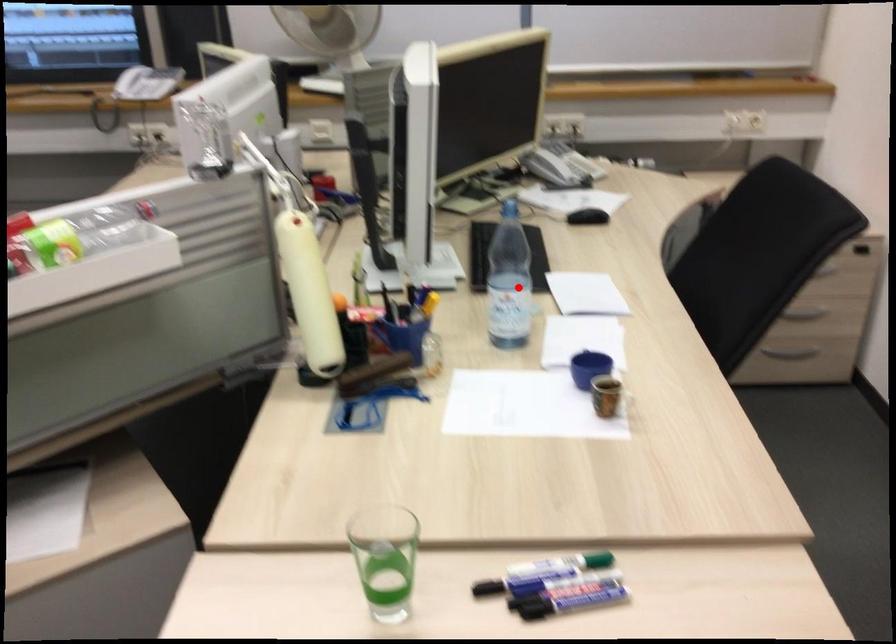
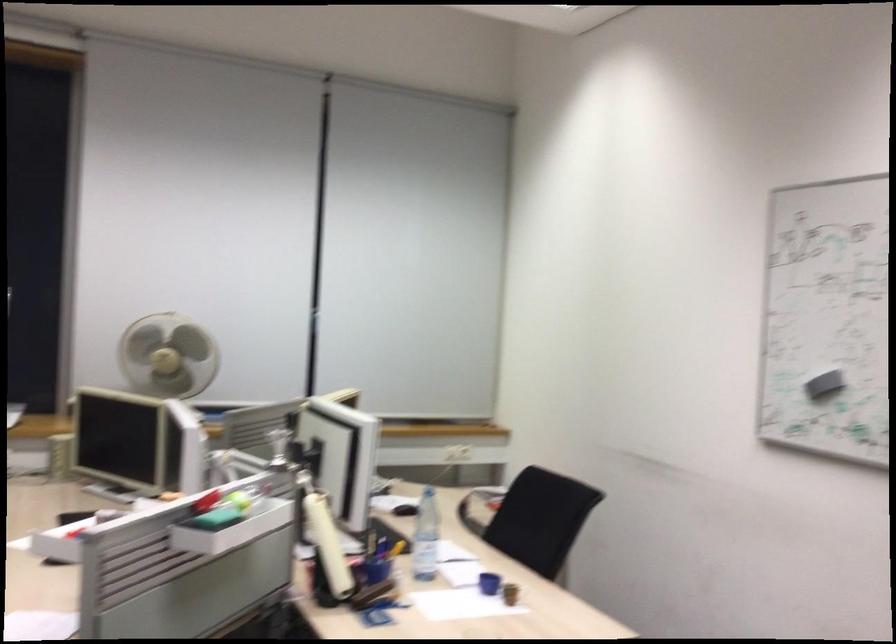
Find the pixel in the second image that matches the highlighted location in the first image.

(426, 536)